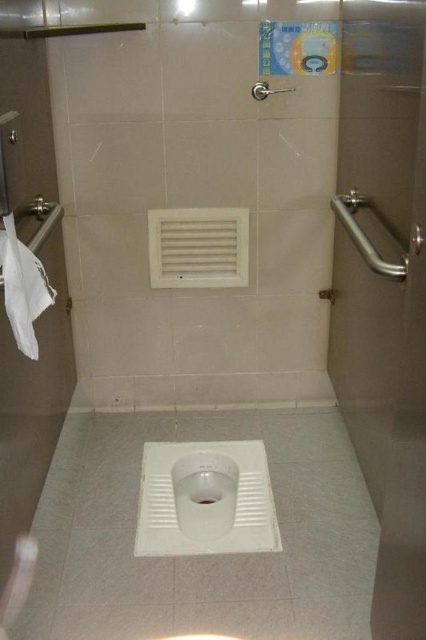
You are standing in the restroom and want to move from the point at coordinates point (17, 291) to the point at coordinates point (215, 497). Which direction should you face to walk towards the second point?

You should face towards the direction of point (215, 497), which is behind point (17, 291) based on their spatial relationship.

You are a maintenance worker inspecting the restroom. You notice the white fabric at left and the white glossy drain at center. Which one is positioned higher in the image?

The white fabric at left is above the white glossy drain at center, so it is positioned higher.